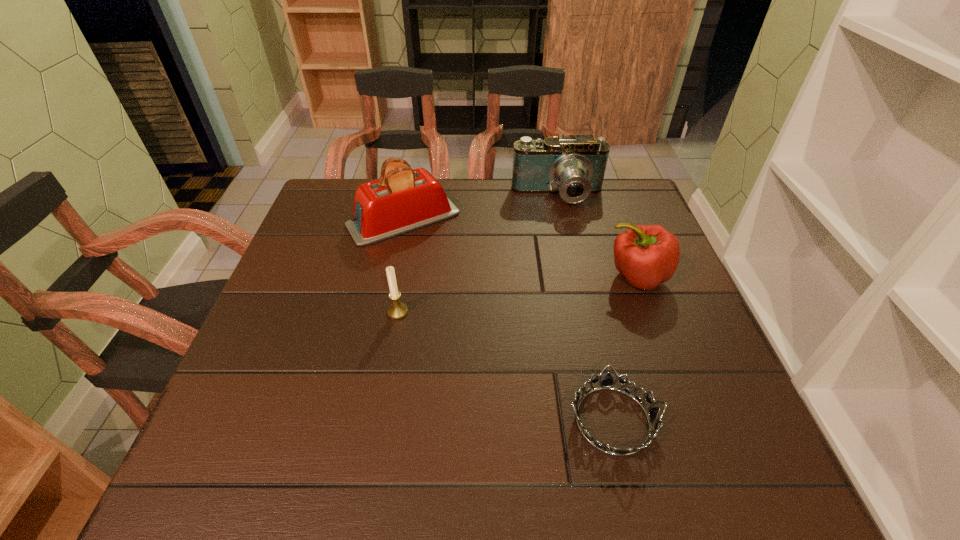
Find the location of a particular element. This screenshot has height=540, width=960. object present at the far left corner is located at coordinates (402, 199).

Identify the location of object present at the far right corner. (573, 166).

Locate an element on the screen. object that is at the near right corner is located at coordinates (607, 383).

Find the location of `free location at the far edge`. free location at the far edge is located at coordinates (551, 201).

You are a GUI agent. You are given a task and a screenshot of the screen. Output one action in this format:
    pyautogui.click(x=<x>, y=<y>)
    Task: Click on the free space at the near edge of the desktop
    The height and width of the screenshot is (540, 960).
    Given the screenshot: What is the action you would take?
    pyautogui.click(x=403, y=469)

This screenshot has width=960, height=540. I want to click on vacant space at the right edge of the desktop, so click(x=695, y=400).

Identify the location of vacant space at the far left corner of the desktop. The width and height of the screenshot is (960, 540). (346, 185).

Locate an element on the screen. This screenshot has width=960, height=540. vacant region at the near right corner is located at coordinates (673, 475).

The height and width of the screenshot is (540, 960). I want to click on vacant point located between the camcorder and the bell pepper, so 597,237.

At what (x,y) coordinates should I click in order to perform the action: click on vacant space that is in between the fourth farthest object and the bell pepper. Please return your answer as a coordinate pair (x, y). The image size is (960, 540). Looking at the image, I should click on (517, 294).